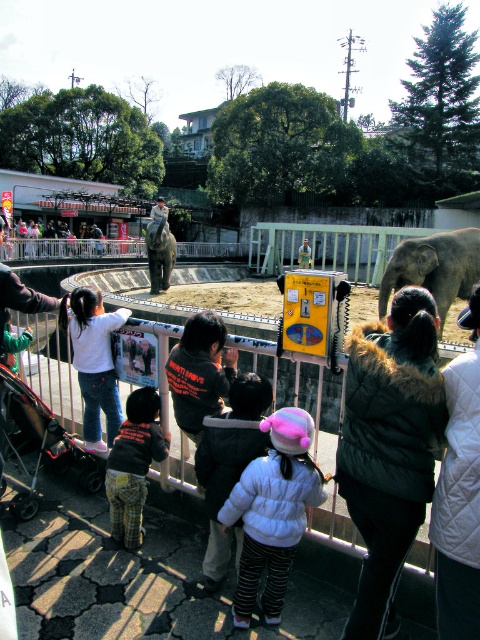
You are standing in the zoo and see two points marked in the image. Which point, point [128,529] or point [154,216], is closer to you?

Point [128,529] is closer to the viewer than point [154,216].

Consider the image. You are a visitor at the zoo and want to take a photo of the gray textured elephant at center without any obstructions. Is the white cotton shirt at left blocking your view of the elephant?

The white cotton shirt at left is in front of the gray textured elephant at center, so it is blocking your view of the elephant. You will need to move to a different position to get an unobstructed view.